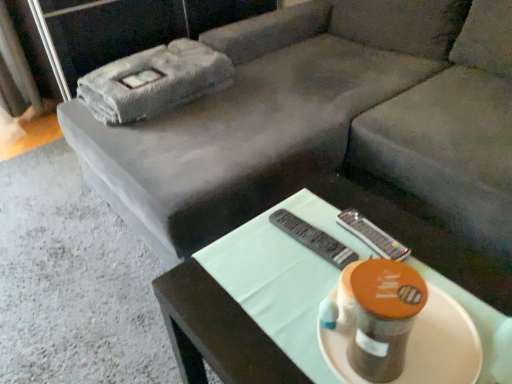
The image size is (512, 384). In order to click on free point behind matte white platter at center in this screenshot , I will do `click(326, 268)`.